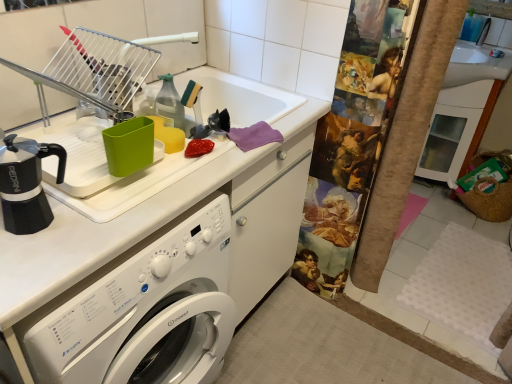
Question: Is brushed metal faucet at upper center positioned before black matte coffee pot at left?

Choices:
 (A) yes
 (B) no

Answer: (B)

Question: Can you confirm if brushed metal faucet at upper center is wider than black matte coffee pot at left?

Choices:
 (A) yes
 (B) no

Answer: (B)

Question: Is brushed metal faucet at upper center smaller than black matte coffee pot at left?

Choices:
 (A) yes
 (B) no

Answer: (A)

Question: From a real-world perspective, is brushed metal faucet at upper center positioned over black matte coffee pot at left based on gravity?

Choices:
 (A) yes
 (B) no

Answer: (A)

Question: Is brushed metal faucet at upper center at the left side of black matte coffee pot at left?

Choices:
 (A) yes
 (B) no

Answer: (B)

Question: In terms of width, does white glossy washing machine at center look wider or thinner when compared to metallic silver dish rack at upper left?

Choices:
 (A) wide
 (B) thin

Answer: (A)

Question: From the image's perspective, is white glossy washing machine at center above or below metallic silver dish rack at upper left?

Choices:
 (A) above
 (B) below

Answer: (B)

Question: Is white glossy washing machine at center inside or outside of metallic silver dish rack at upper left?

Choices:
 (A) inside
 (B) outside

Answer: (B)

Question: Based on their sizes in the image, would you say white glossy washing machine at center is bigger or smaller than metallic silver dish rack at upper left?

Choices:
 (A) small
 (B) big

Answer: (B)

Question: In the image, is brushed metal faucet at upper center positioned in front of or behind white glossy washing machine at center?

Choices:
 (A) front
 (B) behind

Answer: (B)

Question: Considering the positions of point (487, 28) and point (168, 273), is point (487, 28) closer or farther from the camera than point (168, 273)?

Choices:
 (A) farther
 (B) closer

Answer: (A)

Question: Is brushed metal faucet at upper center inside or outside of white glossy washing machine at center?

Choices:
 (A) outside
 (B) inside

Answer: (A)

Question: From a real-world perspective, is brushed metal faucet at upper center physically located above or below white glossy washing machine at center?

Choices:
 (A) above
 (B) below

Answer: (A)

Question: Do you think black matte coffee pot at left is within brushed metal faucet at upper center, or outside of it?

Choices:
 (A) outside
 (B) inside

Answer: (A)

Question: Is point (37, 160) closer or farther from the camera than point (484, 33)?

Choices:
 (A) farther
 (B) closer

Answer: (B)